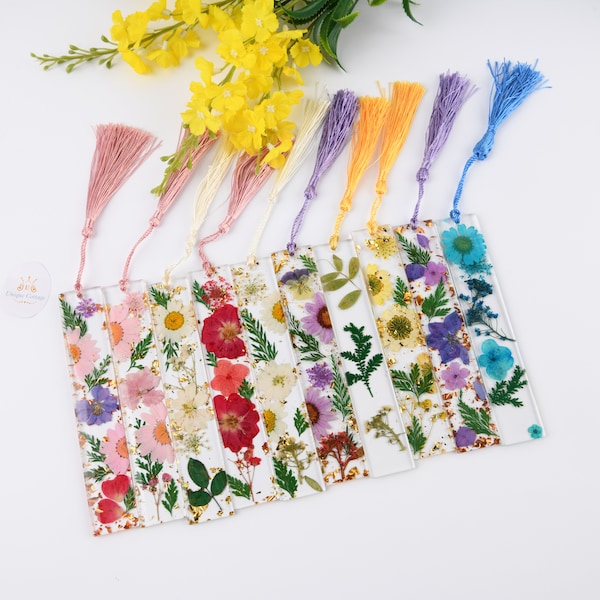
Identify the location of purple tassel. Image resolution: width=600 pixels, height=600 pixels. (324, 130), (347, 132), (317, 167), (428, 130), (438, 132), (429, 155).